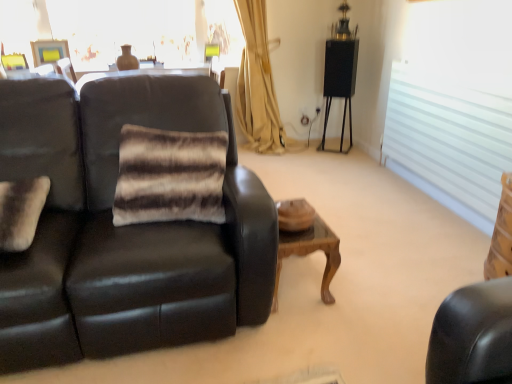
Locate an element on the screen. The image size is (512, 384). free space in front of woodenwoodentable at center is located at coordinates (308, 331).